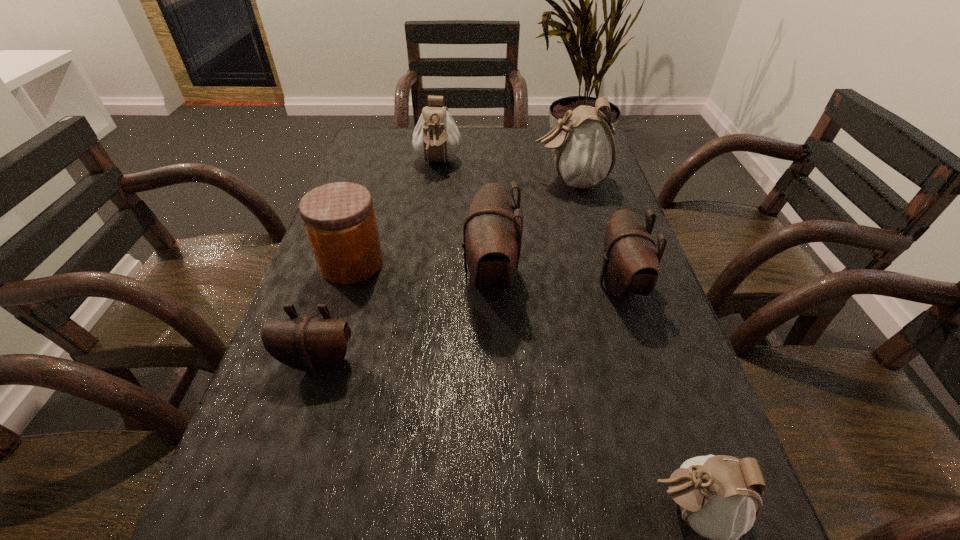
Identify the location of free point between the rightmost brown pouch and the leftmost white pouch. (529, 224).

Where is `free space that is in between the jar and the biggest white pouch`? Image resolution: width=960 pixels, height=540 pixels. free space that is in between the jar and the biggest white pouch is located at coordinates (461, 222).

This screenshot has height=540, width=960. Identify the location of free space that is in between the biggest white pouch and the rightmost brown pouch. (595, 233).

Point out which object is positioned as the fourth nearest to the fourth object from left to right. Please provide its 2D coordinates. Your answer should be formatted as a tuple, i.e. [(x, y)], where the tuple contains the x and y coordinates of a point satisfying the conditions above.

[(311, 344)]

Identify which object is the closest to the biggest white pouch. Please provide its 2D coordinates. Your answer should be formatted as a tuple, i.e. [(x, y)], where the tuple contains the x and y coordinates of a point satisfying the conditions above.

[(492, 233)]

Where is `the third closest pouch to the second pouch from left to right`? The height and width of the screenshot is (540, 960). the third closest pouch to the second pouch from left to right is located at coordinates (630, 266).

Choose which pouch is the third nearest neighbor to the rightmost brown pouch. Please provide its 2D coordinates. Your answer should be formatted as a tuple, i.e. [(x, y)], where the tuple contains the x and y coordinates of a point satisfying the conditions above.

[(719, 496)]

Identify which white pouch is the second closest to the smallest white pouch. Please provide its 2D coordinates. Your answer should be formatted as a tuple, i.e. [(x, y)], where the tuple contains the x and y coordinates of a point satisfying the conditions above.

[(436, 138)]

Point out which white pouch is positioned as the third nearest to the orange jar. Please provide its 2D coordinates. Your answer should be formatted as a tuple, i.e. [(x, y)], where the tuple contains the x and y coordinates of a point satisfying the conditions above.

[(719, 496)]

Identify which brown pouch is the second closest to the nearest object. Please provide its 2D coordinates. Your answer should be formatted as a tuple, i.e. [(x, y)], where the tuple contains the x and y coordinates of a point satisfying the conditions above.

[(492, 233)]